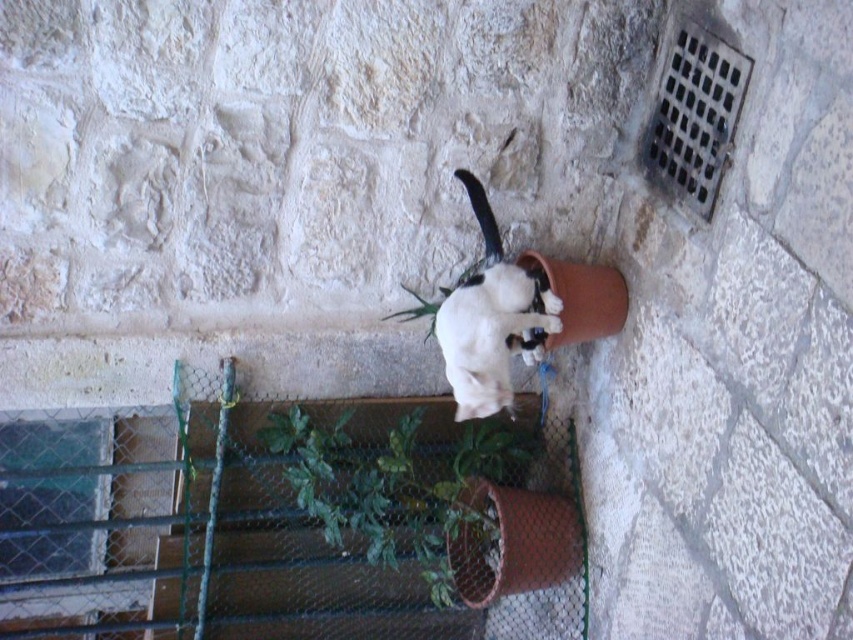
You are standing at the location where the viewer is positioned in the image. You want to water the green textured plant at center. If your watering can has a maximum reach of 6 feet, will you be able to water it without moving closer?

The green textured plant at center and the viewer are 7.00 feet apart from each other. Since the watering can only reaches 6 feet, you will need to move closer to water the plant.

You are a photographer trying to capture the white fur cat at center and the green textured plant at center in the same frame. Based on their positions, will the cat be visible behind the plant in the photo?

The white fur cat at center is behind the green textured plant at center, so the cat may be partially or fully obscured depending on the plant density. However, since the question only asks if it will be visible, the answer is yes, as the cat is positioned behind the plant and not blocked entirely unless the plant is dense enough to hide it completely. But since we don not have information about the plant density, we can assume the cat is visible behind it.

You are a photographer trying to capture the white fur cat at center and the green mesh fence at lower left in a single shot. Which object should you focus on first if you want to ensure both are in frame without moving the camera?

You should focus on the green mesh fence at lower left first because it is larger in size than the white fur cat at center, so it will be easier to frame and adjust the shot to include both.